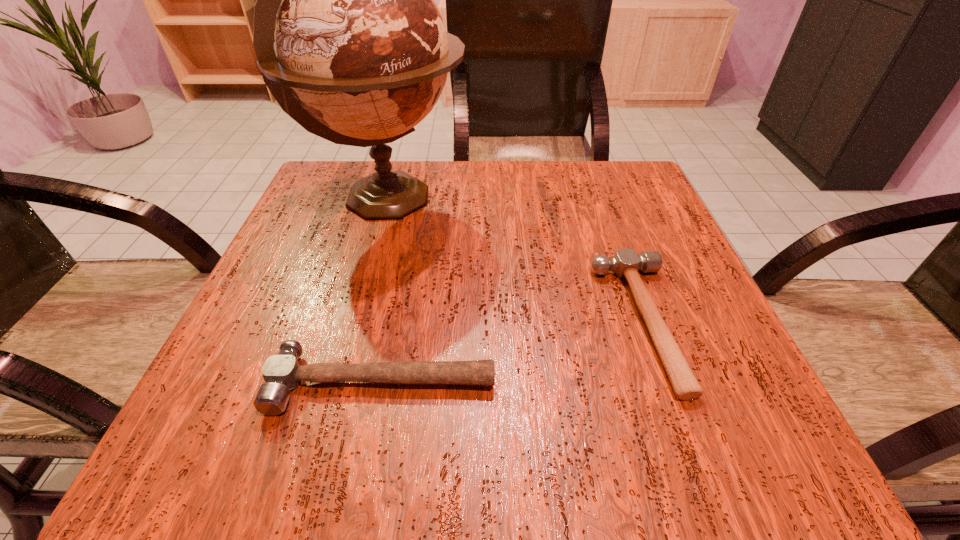
Locate an element on the screen. This screenshot has height=540, width=960. object present at the right edge is located at coordinates (626, 263).

I want to click on object located at the far left corner, so click(x=363, y=54).

Find the location of a particular element. The width and height of the screenshot is (960, 540). object that is at the near left corner is located at coordinates (282, 372).

Locate an element on the screen. This screenshot has width=960, height=540. vacant space at the far edge of the desktop is located at coordinates (466, 161).

Locate an element on the screen. free space at the near edge of the desktop is located at coordinates (574, 447).

The height and width of the screenshot is (540, 960). I want to click on vacant space at the left edge, so click(x=282, y=339).

Identify the location of vacant space at the right edge of the desktop. This screenshot has width=960, height=540. (645, 233).

This screenshot has width=960, height=540. Find the location of `vacant region at the far left corner of the desktop`. vacant region at the far left corner of the desktop is located at coordinates (299, 213).

In the image, there is a desktop. Where is `vacant space at the near left corner`? The width and height of the screenshot is (960, 540). vacant space at the near left corner is located at coordinates (223, 409).

Identify the location of free region at the far right corner of the desktop. (636, 167).